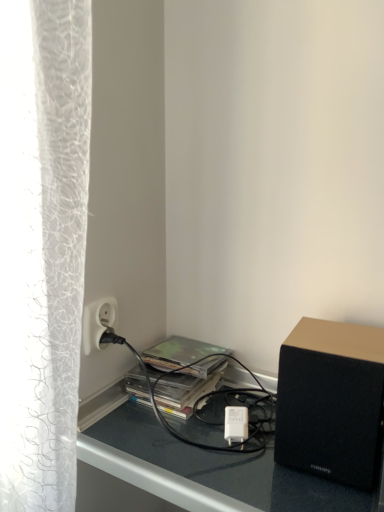
Question: From a real-world perspective, does black matte speaker at lower right sit lower than white plastic power outlet at lower left?

Choices:
 (A) no
 (B) yes

Answer: (B)

Question: From the image's perspective, is black matte speaker at lower right below white plastic power outlet at lower left?

Choices:
 (A) no
 (B) yes

Answer: (B)

Question: Is white plastic power outlet at lower left inside black matte speaker at lower right?

Choices:
 (A) no
 (B) yes

Answer: (A)

Question: Is black matte speaker at lower right further to the viewer compared to white plastic power outlet at lower left?

Choices:
 (A) yes
 (B) no

Answer: (B)

Question: Is black matte speaker at lower right smaller than white plastic power outlet at lower left?

Choices:
 (A) yes
 (B) no

Answer: (B)

Question: Could you tell me if black matte speaker at lower right is facing white plastic power outlet at lower left?

Choices:
 (A) no
 (B) yes

Answer: (A)

Question: Considering the relative positions of camouflage paper at center and white plastic power outlet at lower left in the image provided, is camouflage paper at center in front of white plastic power outlet at lower left?

Choices:
 (A) yes
 (B) no

Answer: (B)

Question: Is camouflage paper at center outside of white plastic power outlet at lower left?

Choices:
 (A) yes
 (B) no

Answer: (A)

Question: Considering the relative sizes of camouflage paper at center and white plastic power outlet at lower left in the image provided, is camouflage paper at center thinner than white plastic power outlet at lower left?

Choices:
 (A) yes
 (B) no

Answer: (B)

Question: Can you see camouflage paper at center touching white plastic power outlet at lower left?

Choices:
 (A) yes
 (B) no

Answer: (B)

Question: Does camouflage paper at center lie behind white plastic power outlet at lower left?

Choices:
 (A) no
 (B) yes

Answer: (B)

Question: Considering the relative positions of camouflage paper at center and white plastic power outlet at lower left in the image provided, is camouflage paper at center to the right of white plastic power outlet at lower left from the viewer's perspective?

Choices:
 (A) no
 (B) yes

Answer: (B)

Question: Is black matte speaker at lower right at the left side of camouflage paper at center?

Choices:
 (A) yes
 (B) no

Answer: (B)